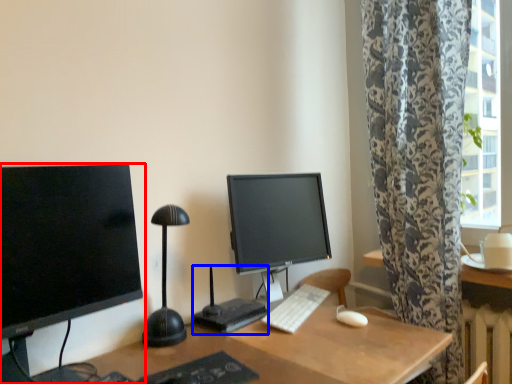
Question: Which point is further to the camera, computer monitor (highlighted by a red box) or computer desk (highlighted by a blue box)?

Choices:
 (A) computer monitor
 (B) computer desk

Answer: (B)